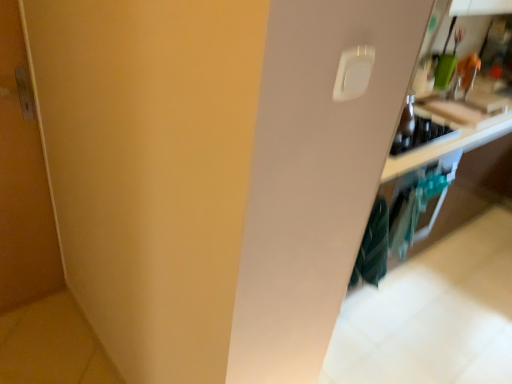
Question: Is wooden cutting board at upper right bigger than teal striped fabric at lower right?

Choices:
 (A) yes
 (B) no

Answer: (B)

Question: From the image's perspective, would you say wooden cutting board at upper right is shown under teal striped fabric at lower right?

Choices:
 (A) no
 (B) yes

Answer: (A)

Question: Is wooden cutting board at upper right with teal striped fabric at lower right?

Choices:
 (A) yes
 (B) no

Answer: (B)

Question: Would you say wooden cutting board at upper right contains teal striped fabric at lower right?

Choices:
 (A) yes
 (B) no

Answer: (B)

Question: Considering the relative sizes of wooden cutting board at upper right and teal striped fabric at lower right in the image provided, is wooden cutting board at upper right taller than teal striped fabric at lower right?

Choices:
 (A) yes
 (B) no

Answer: (B)

Question: Considering the relative sizes of wooden cutting board at upper right and teal striped fabric at lower right in the image provided, is wooden cutting board at upper right thinner than teal striped fabric at lower right?

Choices:
 (A) yes
 (B) no

Answer: (B)

Question: Is wooden cutting board at upper right to the left of matte wood door at left from the viewer's perspective?

Choices:
 (A) yes
 (B) no

Answer: (B)

Question: From a real-world perspective, is wooden cutting board at upper right over matte wood door at left?

Choices:
 (A) yes
 (B) no

Answer: (A)

Question: Does wooden cutting board at upper right come in front of matte wood door at left?

Choices:
 (A) yes
 (B) no

Answer: (B)

Question: Does wooden cutting board at upper right have a smaller size compared to matte wood door at left?

Choices:
 (A) no
 (B) yes

Answer: (B)

Question: Considering the relative positions of wooden cutting board at upper right and matte wood door at left in the image provided, is wooden cutting board at upper right to the right of matte wood door at left from the viewer's perspective?

Choices:
 (A) yes
 (B) no

Answer: (A)

Question: Is wooden cutting board at upper right wider than matte wood door at left?

Choices:
 (A) no
 (B) yes

Answer: (B)

Question: Considering the relative sizes of teal striped fabric at lower right and white plastic light switch at upper right in the image provided, is teal striped fabric at lower right thinner than white plastic light switch at upper right?

Choices:
 (A) yes
 (B) no

Answer: (B)